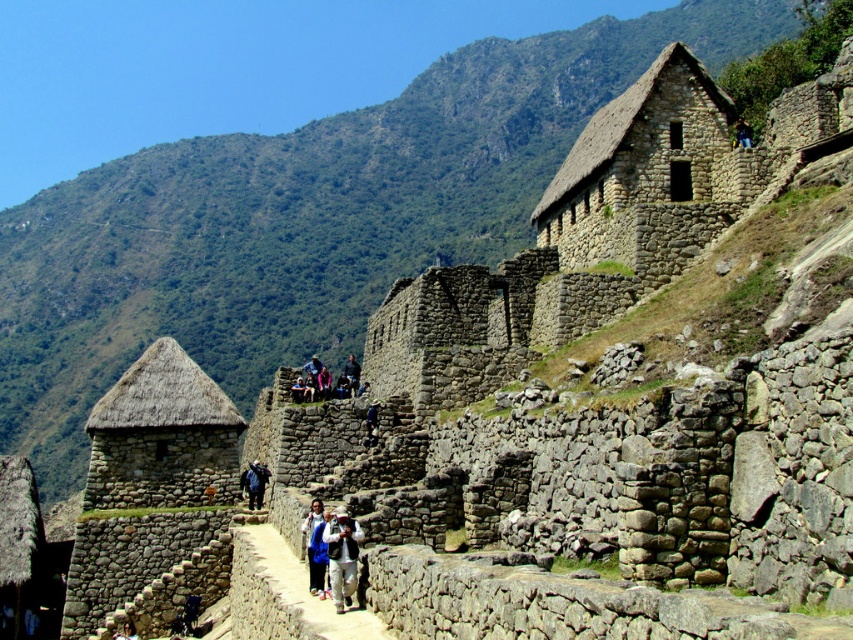
Question: Which of these objects is positioned farthest from the stone textured hut at upper right?

Choices:
 (A) sandy stone path at center
 (B) blue fabric backpack at center
 (C) dark blue fabric at upper right

Answer: (A)

Question: Is thatched stone hut at center-left wider than dark brown leather jacket at center?

Choices:
 (A) yes
 (B) no

Answer: (B)

Question: Which object is positioned closest to the thatched stone hut at center-left?

Choices:
 (A) sandy stone path at center
 (B) dark brown leather jacket at center
 (C) stone textured hut at upper right

Answer: (A)

Question: Can you confirm if thatched stone hut at center-left is smaller than blue fabric jacket at center?

Choices:
 (A) yes
 (B) no

Answer: (B)

Question: Does sandy stone path at center appear over blue fabric backpack at center?

Choices:
 (A) yes
 (B) no

Answer: (B)

Question: Among these points, which one is nearest to the camera?

Choices:
 (A) (735, 125)
 (B) (108, 426)

Answer: (B)